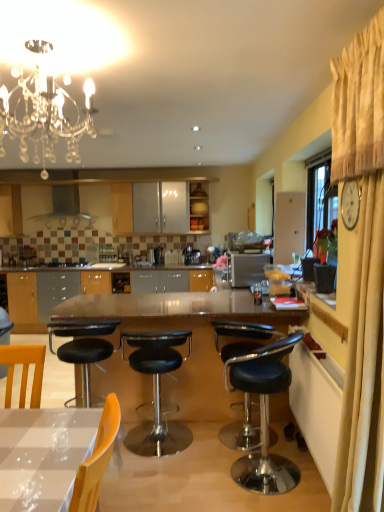
I want to click on empty space that is ontop of crystal glass chandelier at upper left (from a real-world perspective), so click(29, 42).